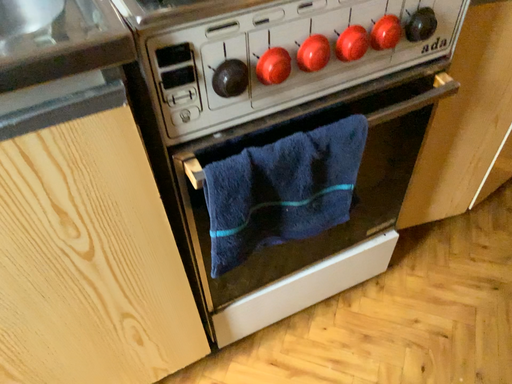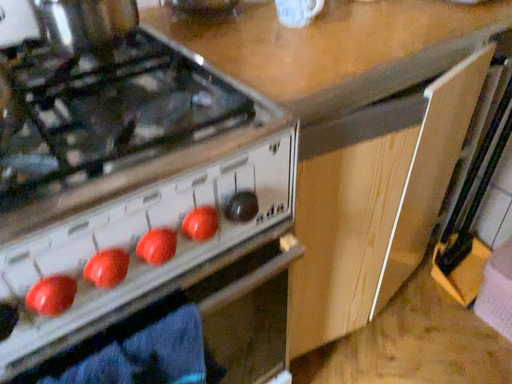
Question: Which way did the camera rotate in the video?

Choices:
 (A) rotated upward
 (B) rotated downward

Answer: (A)